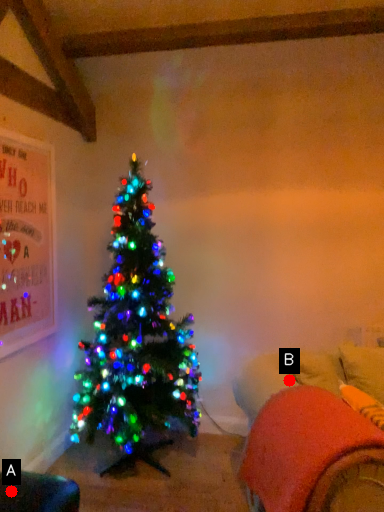
Question: Two points are circled on the image, labeled by A and B beside each circle. Which point appears farthest from the camera in this image?

Choices:
 (A) A is further
 (B) B is further

Answer: (B)